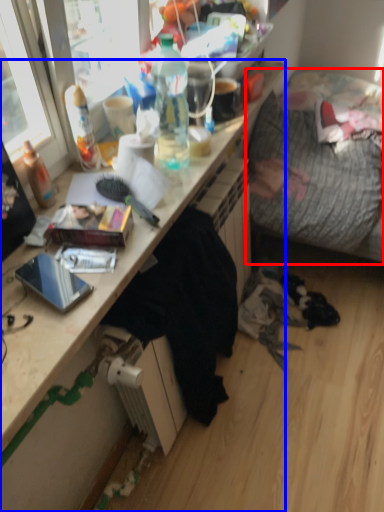
Question: Among these objects, which one is farthest to the camera, studio couch (highlighted by a red box) or desk (highlighted by a blue box)?

Choices:
 (A) studio couch
 (B) desk

Answer: (A)